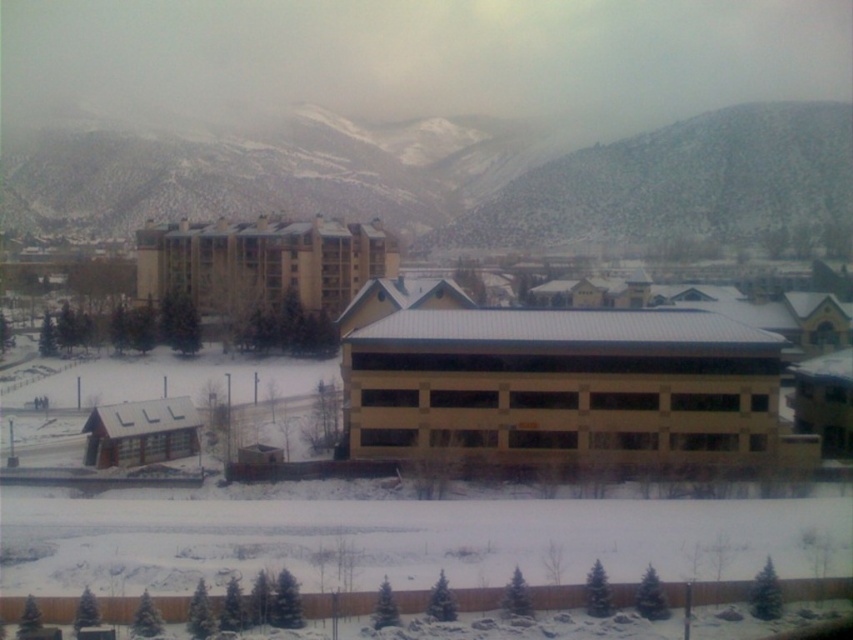
You are standing at the base of the snow covered mountains in the snowy landscape image. You see a point marked at coordinates (461,182). Based on the scene description, where is this point located?

The point marked at coordinates (461,182) is located on the snow covered mountain at upper center.

You are standing in a snowy landscape and want to take a photo of the beige concrete parking garage at center. If your camera can focus on objects up to 60 meters away, will you need to move closer to get a clear shot?

The beige concrete parking garage at center is 65.64 meters away from camera, which is beyond the camera focus range of 60 meters. You need to move closer to get a clear shot.